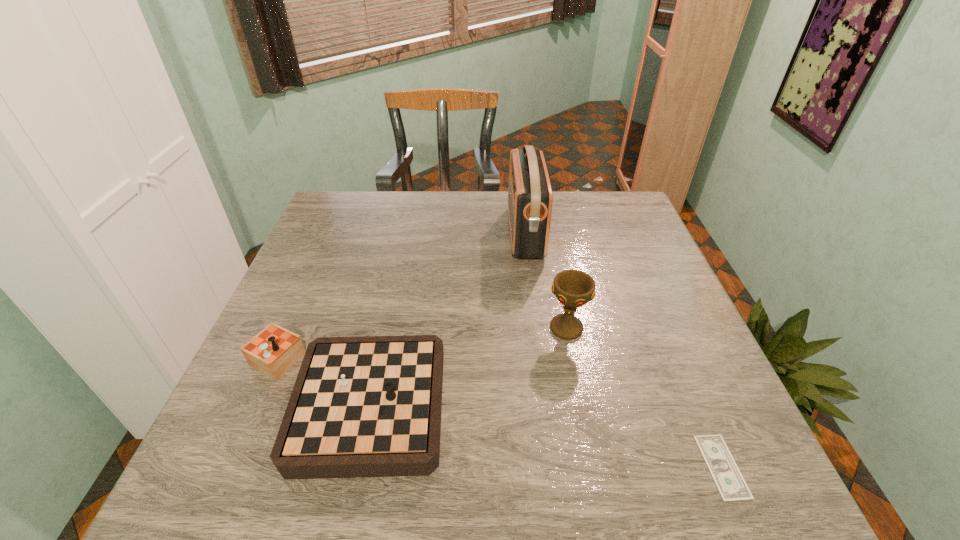
The image size is (960, 540). I want to click on vacant space that satisfies the following two spatial constraints: 1. on the front side of the second shortest object; 2. on the left side of the money, so click(x=320, y=467).

The width and height of the screenshot is (960, 540). What are the coordinates of `vacant point that satisfies the following two spatial constraints: 1. on the front-facing side of the farthest object; 2. on the right side of the chalice` in the screenshot? It's located at (538, 328).

Image resolution: width=960 pixels, height=540 pixels. I want to click on blank area in the image that satisfies the following two spatial constraints: 1. on the front-facing side of the money; 2. on the right side of the tallest object, so click(x=556, y=467).

Where is `vacant area that satisfies the following two spatial constraints: 1. on the front-facing side of the tallest object; 2. on the back side of the money`? vacant area that satisfies the following two spatial constraints: 1. on the front-facing side of the tallest object; 2. on the back side of the money is located at coordinates (556, 467).

You are a GUI agent. You are given a task and a screenshot of the screen. Output one action in this format:
    pyautogui.click(x=<x>, y=<y>)
    Task: Click on the free spot that satisfies the following two spatial constraints: 1. on the front-facing side of the tallest object; 2. on the front side of the second shortest object
    This screenshot has width=960, height=540.
    Given the screenshot: What is the action you would take?
    pyautogui.click(x=547, y=400)